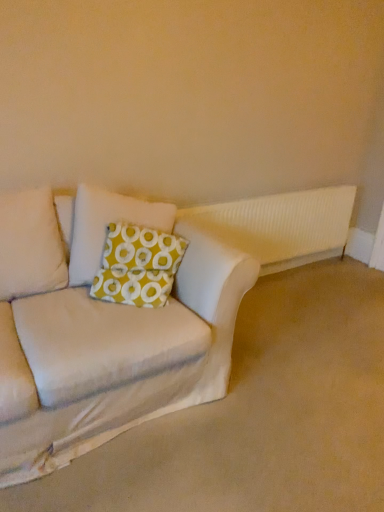
Question: Is beige fabric couch at lower left oriented away from white ribbed radiator at upper right?

Choices:
 (A) no
 (B) yes

Answer: (A)

Question: Considering the relative sizes of beige fabric couch at lower left and white ribbed radiator at upper right in the image provided, is beige fabric couch at lower left taller than white ribbed radiator at upper right?

Choices:
 (A) yes
 (B) no

Answer: (B)

Question: Is white ribbed radiator at upper right inside beige fabric couch at lower left?

Choices:
 (A) yes
 (B) no

Answer: (B)

Question: Is the surface of beige fabric couch at lower left in direct contact with white ribbed radiator at upper right?

Choices:
 (A) yes
 (B) no

Answer: (B)

Question: From the image's perspective, is beige fabric couch at lower left below white ribbed radiator at upper right?

Choices:
 (A) no
 (B) yes

Answer: (B)

Question: Is white ribbed radiator at upper right bigger or smaller than green fabric pillow at center?

Choices:
 (A) big
 (B) small

Answer: (A)

Question: From the image's perspective, relative to green fabric pillow at center, is white ribbed radiator at upper right above or below?

Choices:
 (A) above
 (B) below

Answer: (A)

Question: Considering the relative positions of white ribbed radiator at upper right and green fabric pillow at center in the image provided, is white ribbed radiator at upper right to the left or to the right of green fabric pillow at center?

Choices:
 (A) right
 (B) left

Answer: (A)

Question: Considering the positions of point (183, 208) and point (173, 259), is point (183, 208) closer or farther from the camera than point (173, 259)?

Choices:
 (A) closer
 (B) farther

Answer: (B)

Question: In terms of width, does yellowpatterned fabricpillow at center look wider or thinner when compared to beige fabric couch at lower left?

Choices:
 (A) wide
 (B) thin

Answer: (B)

Question: From the image's perspective, is yellowpatterned fabricpillow at center above or below beige fabric couch at lower left?

Choices:
 (A) above
 (B) below

Answer: (A)

Question: From a real-world perspective, is yellowpatterned fabricpillow at center above or below beige fabric couch at lower left?

Choices:
 (A) above
 (B) below

Answer: (A)

Question: Considering the positions of yellowpatterned fabricpillow at center and beige fabric couch at lower left in the image, is yellowpatterned fabricpillow at center taller or shorter than beige fabric couch at lower left?

Choices:
 (A) short
 (B) tall

Answer: (B)

Question: In terms of size, does white ribbed radiator at upper right appear bigger or smaller than beige fabric couch at lower left?

Choices:
 (A) big
 (B) small

Answer: (B)

Question: Do you think white ribbed radiator at upper right is within beige fabric couch at lower left, or outside of it?

Choices:
 (A) inside
 (B) outside

Answer: (B)